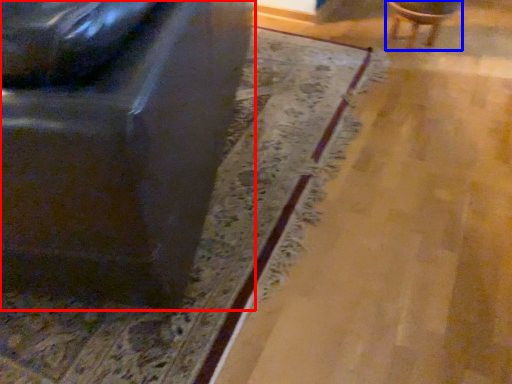
Question: Which object is closer to the camera taking this photo, chair (highlighted by a red box) or chair (highlighted by a blue box)?

Choices:
 (A) chair
 (B) chair

Answer: (A)